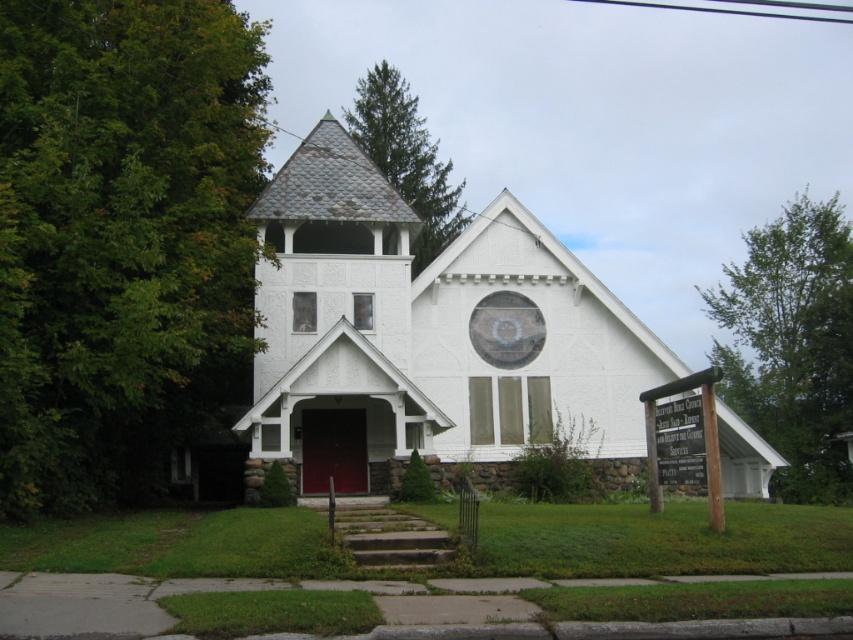
Is point (321, 401) positioned after point (430, 172)?

No, (321, 401) is in front of (430, 172).

Does white textured church at center have a greater height compared to green textured pine tree at upper center?

No, white textured church at center is not taller than green textured pine tree at upper center.

Which is behind, point (560, 260) or point (358, 90)?

Positioned behind is point (358, 90).

Identify the location of white textured church at center. This screenshot has height=640, width=853. (424, 333).

Is green leafy tree at left below white textured church at center?

Actually, green leafy tree at left is above white textured church at center.

Between green leafy tree at left and white textured church at center, which one has less height?

white textured church at center

Which is behind, point (33, 81) or point (312, 221)?

Point (312, 221)

Where is `green leafy tree at left`? The width and height of the screenshot is (853, 640). green leafy tree at left is located at coordinates (120, 236).

Is green leafy tree at left positioned in front of green textured pine tree at upper center?

Yes.

Locate an element on the screen. green leafy tree at left is located at coordinates (120, 236).